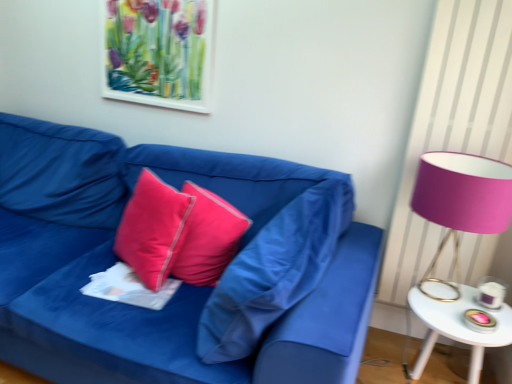
Question: Considering the relative positions of matte pink pillow at center, which appears as the 1th pillow when viewed from the right, and white paper at center in the image provided, is matte pink pillow at center, which appears as the 1th pillow when viewed from the right, behind white paper at center?

Choices:
 (A) no
 (B) yes

Answer: (A)

Question: Would you say matte pink pillow at center, the third pillow when ordered from left to right, contains white paper at center?

Choices:
 (A) no
 (B) yes

Answer: (A)

Question: From the image's perspective, does matte pink pillow at center, which appears as the 1th pillow when viewed from the right, appear lower than white paper at center?

Choices:
 (A) yes
 (B) no

Answer: (B)

Question: Considering the relative sizes of matte pink pillow at center, the third pillow when ordered from left to right, and white paper at center in the image provided, is matte pink pillow at center, the third pillow when ordered from left to right, shorter than white paper at center?

Choices:
 (A) yes
 (B) no

Answer: (B)

Question: From a real-world perspective, does matte pink pillow at center, the third pillow when ordered from left to right, sit lower than white paper at center?

Choices:
 (A) no
 (B) yes

Answer: (A)

Question: Is point (181, 226) positioned closer to the camera than point (281, 269)?

Choices:
 (A) farther
 (B) closer

Answer: (A)

Question: From the image's perspective, relative to matte pink pillow at center, the third pillow when ordered from left to right, is satin pink pillow at center, the 3th pillow when ordered from right to left, above or below?

Choices:
 (A) below
 (B) above

Answer: (B)

Question: From a real-world perspective, is satin pink pillow at center, the 3th pillow when ordered from right to left, positioned above or below matte pink pillow at center, which appears as the 1th pillow when viewed from the right?

Choices:
 (A) below
 (B) above

Answer: (A)

Question: Looking at the image, does satin pink pillow at center, the 3th pillow when ordered from right to left, seem bigger or smaller compared to matte pink pillow at center, the third pillow when ordered from left to right?

Choices:
 (A) small
 (B) big

Answer: (A)

Question: Considering the positions of point (434, 218) and point (234, 220), is point (434, 218) closer or farther from the camera than point (234, 220)?

Choices:
 (A) closer
 (B) farther

Answer: (A)

Question: Is pink fabric lampshade at right to the left or to the right of silky pink pillow at center, which ranks as the second pillow in right-to-left order, in the image?

Choices:
 (A) left
 (B) right

Answer: (B)

Question: In the image, is pink fabric lampshade at right positioned in front of or behind silky pink pillow at center, which ranks as the second pillow in right-to-left order?

Choices:
 (A) behind
 (B) front

Answer: (B)

Question: Which is correct: pink fabric lampshade at right is inside silky pink pillow at center, which ranks as the second pillow in right-to-left order, or outside of it?

Choices:
 (A) outside
 (B) inside

Answer: (A)

Question: Is point (112, 286) closer or farther from the camera than point (470, 178)?

Choices:
 (A) farther
 (B) closer

Answer: (A)

Question: Looking at the image, does white paper at center seem bigger or smaller compared to pink fabric lampshade at right?

Choices:
 (A) big
 (B) small

Answer: (B)